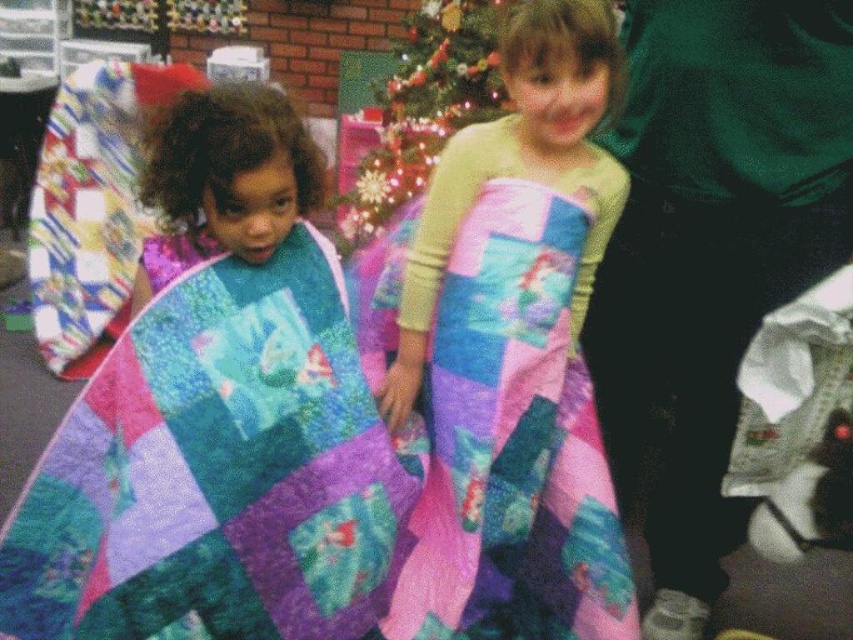
Can you confirm if multicolored quilt at left is positioned below shiny green christmas tree at upper center?

Indeed, multicolored quilt at left is positioned under shiny green christmas tree at upper center.

From the picture: Is multicolored quilt at left shorter than shiny green christmas tree at upper center?

Correct, multicolored quilt at left is not as tall as shiny green christmas tree at upper center.

What do you see at coordinates (216, 472) in the screenshot? I see `multicolored quilt at left` at bounding box center [216, 472].

Locate an element on the screen. This screenshot has height=640, width=853. multicolored quilt at left is located at coordinates (216, 472).

Is multicolored fleece blanket at center below shiny green christmas tree at upper center?

Indeed, multicolored fleece blanket at center is positioned under shiny green christmas tree at upper center.

Between point (538, 477) and point (351, 227), which one is positioned behind?

The point (351, 227) is more distant.

Which is behind, point (541, 529) or point (370, 109)?

The point (370, 109) is behind.

Find the location of a particular element. The width and height of the screenshot is (853, 640). multicolored fleece blanket at center is located at coordinates (514, 355).

Is point (517, 228) positioned before point (230, 202)?

That is False.

Can you confirm if multicolored fleece blanket at center is bigger than multicolored quilted blanket at left?

Yes.

Who is more distant from viewer, [465,324] or [274,241]?

Positioned behind is point [465,324].

Locate an element on the screen. Image resolution: width=853 pixels, height=640 pixels. multicolored fleece blanket at center is located at coordinates (514, 355).